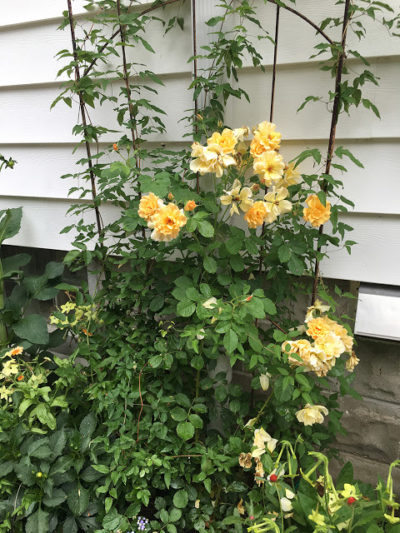
At what (x,y) coordinates should I click in order to perform the action: click on plant. Please return your answer as a coordinate pair (x, y). Image resolution: width=400 pixels, height=533 pixels. Looking at the image, I should click on (198, 294).